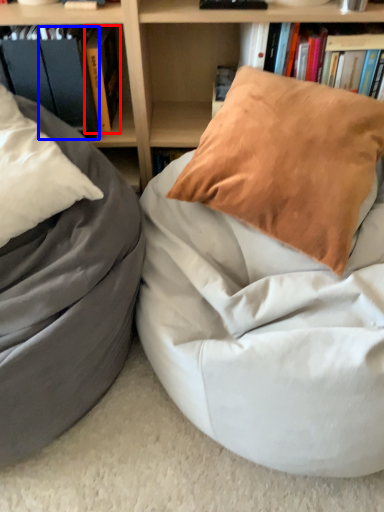
Question: Among these objects, which one is nearest to the camera, book (highlighted by a red box) or paperback book (highlighted by a blue box)?

Choices:
 (A) book
 (B) paperback book

Answer: (B)